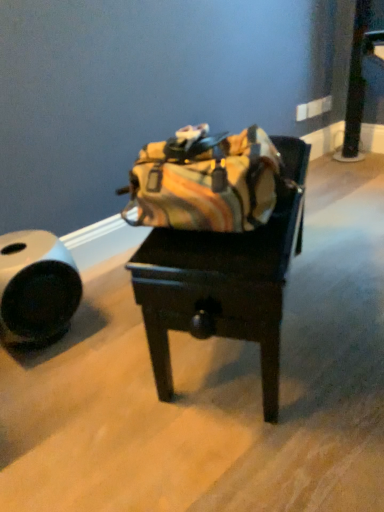
Question: Considering the relative positions of leather duffel bag at center and white matte tube at left in the image provided, is leather duffel bag at center to the right of white matte tube at left from the viewer's perspective?

Choices:
 (A) yes
 (B) no

Answer: (A)

Question: Is leather duffel bag at center positioned in front of white matte tube at left?

Choices:
 (A) no
 (B) yes

Answer: (B)

Question: Would you consider leather duffel bag at center to be distant from white matte tube at left?

Choices:
 (A) no
 (B) yes

Answer: (A)

Question: Can you confirm if leather duffel bag at center is wider than white matte tube at left?

Choices:
 (A) yes
 (B) no

Answer: (A)

Question: Is white matte tube at left a part of leather duffel bag at center?

Choices:
 (A) yes
 (B) no

Answer: (B)

Question: From the image's perspective, is leather duffel bag at center over white matte tube at left?

Choices:
 (A) no
 (B) yes

Answer: (B)

Question: Considering the relative positions of white matte tube at left and leather duffel bag at center in the image provided, is white matte tube at left to the left of leather duffel bag at center from the viewer's perspective?

Choices:
 (A) no
 (B) yes

Answer: (B)

Question: From a real-world perspective, is white matte tube at left under leather duffel bag at center?

Choices:
 (A) yes
 (B) no

Answer: (A)

Question: Considering the relative positions of white matte tube at left and leather duffel bag at center in the image provided, is white matte tube at left to the right of leather duffel bag at center from the viewer's perspective?

Choices:
 (A) yes
 (B) no

Answer: (B)

Question: From the image's perspective, would you say white matte tube at left is positioned over leather duffel bag at center?

Choices:
 (A) no
 (B) yes

Answer: (A)

Question: Is white matte tube at left surrounding leather duffel bag at center?

Choices:
 (A) no
 (B) yes

Answer: (A)

Question: Is white matte tube at left smaller than leather duffel bag at center?

Choices:
 (A) yes
 (B) no

Answer: (A)

Question: From a real-world perspective, is leather duffel bag at center positioned above or below white matte tube at left?

Choices:
 (A) below
 (B) above

Answer: (B)